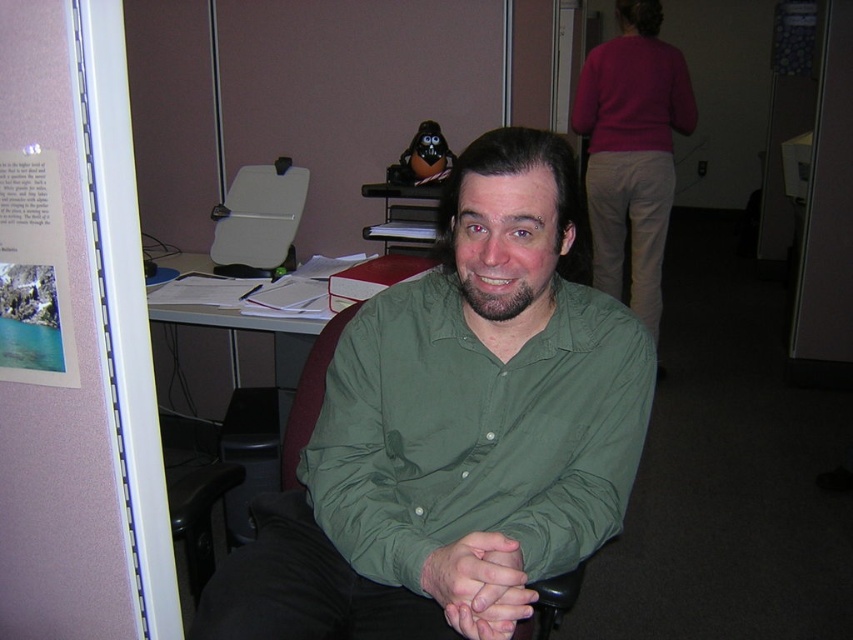
Which is more to the right, green matte dress shirt at center or green fabric chair at center?

From the viewer's perspective, green matte dress shirt at center appears more on the right side.

Is point (627, 141) positioned after point (555, 600)?

Yes.

Where is `green matte dress shirt at center`? The image size is (853, 640). green matte dress shirt at center is located at coordinates (631, 150).

Who is more distant from viewer, (521, 570) or (309, 378)?

The point (309, 378) is behind.

Between point (479, 632) and point (316, 417), which one is positioned in front?

Positioned in front is point (479, 632).

Identify the location of green matte hands at center. (479, 584).

Can you confirm if green matte shirt at center is positioned to the right of green matte dress shirt at center?

No, green matte shirt at center is not to the right of green matte dress shirt at center.

Is green matte shirt at center wider than green matte dress shirt at center?

Yes, green matte shirt at center is wider than green matte dress shirt at center.

Between point (347, 512) and point (612, 141), which one is positioned behind?

Point (612, 141)

At what (x,y) coordinates should I click in order to perform the action: click on green matte shirt at center. Please return your answer as a coordinate pair (x, y). This screenshot has width=853, height=640. Looking at the image, I should click on click(456, 432).